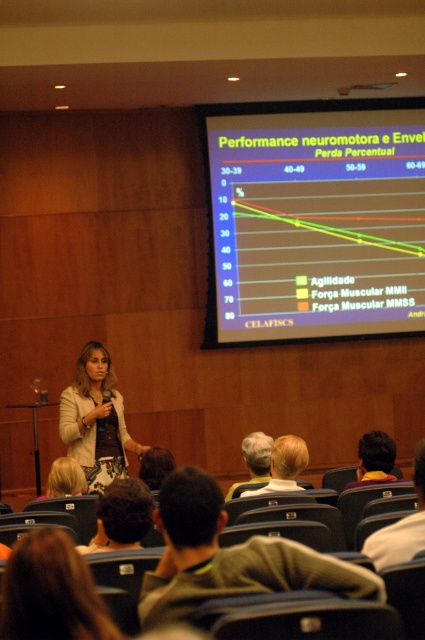
Question: In this image, where is brown fabric shirt at lower center located relative to dark brown hair at lower center?

Choices:
 (A) above
 (B) below

Answer: (A)

Question: Which object is farther from the camera taking this photo?

Choices:
 (A) brown hair at lower center
 (B) brown fabric shirt at lower center
 (C) light brown hair at center
 (D) blonde hair at center

Answer: (A)

Question: Which object is closer to the camera taking this photo?

Choices:
 (A) dark brown hair at lower center
 (B) brown fabric shirt at lower center
 (C) yellow matte projection screen at upper center
 (D) yellow shirt at lower right

Answer: (B)

Question: Does dark brown hair at center have a larger size compared to brown hair at lower center?

Choices:
 (A) no
 (B) yes

Answer: (B)

Question: Does dark brown hair at center appear over light brown hair at center?

Choices:
 (A) no
 (B) yes

Answer: (B)

Question: Which point is closer to the camera?

Choices:
 (A) light brown hair at center
 (B) matte beige blazer at center

Answer: (A)